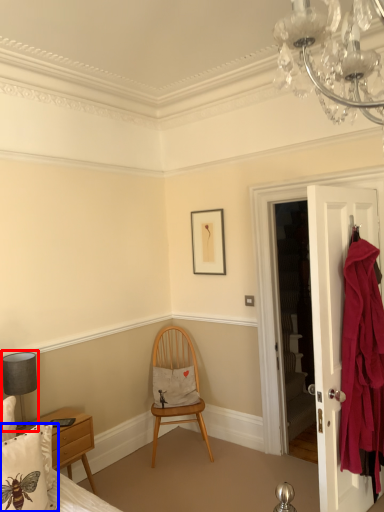
Question: Which object is closer to the camera taking this photo, lamp (highlighted by a red box) or pillow (highlighted by a blue box)?

Choices:
 (A) lamp
 (B) pillow

Answer: (B)